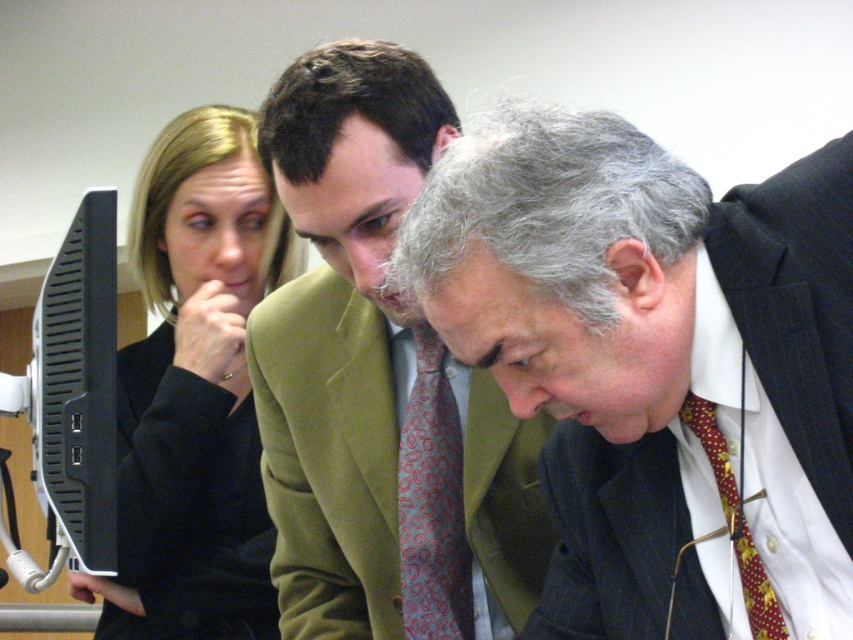
You are a tailor measuring fabrics for a client. The client wants to know if the black fabric at left is wider than the dark blue pinstripe suit at lower right. Can you confirm this?

The black fabric at left is wider than the dark blue pinstripe suit at lower right according to the description.

You are a security guard in the building. You need to check if the green fabric jacket at center is blocking the view of the black plastic monitor at left. Based on the scene description, can you determine if the jacket is obstructing the monitor?

The green fabric jacket at center is located above the black plastic monitor at left, so it is not blocking the monitor since it is positioned higher up.